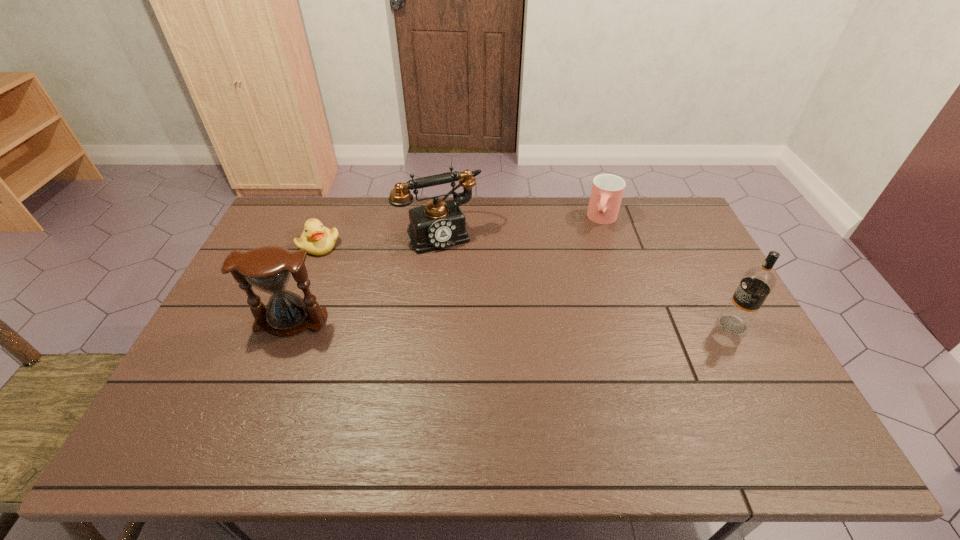
The height and width of the screenshot is (540, 960). Find the location of `vacant space on the desktop that is between the hourglass and the vodka and is positioned on the front-facing side of the shortest object`. vacant space on the desktop that is between the hourglass and the vodka and is positioned on the front-facing side of the shortest object is located at coordinates (462, 323).

Find the location of a particular element. This screenshot has height=540, width=960. vacant space on the desktop that is between the hourglass and the rightmost object and is positioned on the front of the third object from left to right at the rotary dial is located at coordinates (484, 323).

The width and height of the screenshot is (960, 540). In order to click on vacant space on the desktop that is between the hourglass and the vodka and is positioned on the side of the cup with the handle in this screenshot , I will do `click(569, 323)`.